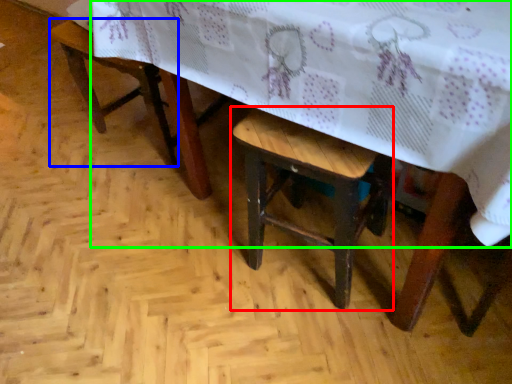
Question: Which is farther away from stool (highlighted by a red box)? armchair (highlighted by a blue box) or table (highlighted by a green box)?

Choices:
 (A) armchair
 (B) table

Answer: (A)